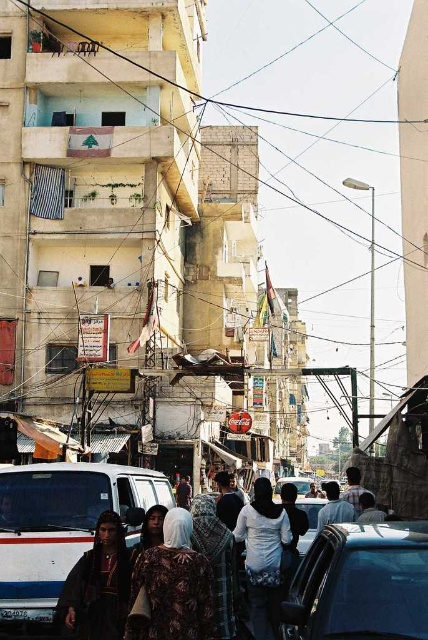
Question: Considering the real-world distances, which object is closest to the metallic wire at upper center?

Choices:
 (A) light brown fabric headscarf at center
 (B) white matte van at center
 (C) dark brown leather jacket at center

Answer: (C)

Question: Which is farther from the floral fabric dress at center?

Choices:
 (A) white matte van at center
 (B) shiny black car at center
 (C) dark brown fabric at center

Answer: (C)

Question: Is dark brown fabric at center to the left of dark brown leather jacket at center from the viewer's perspective?

Choices:
 (A) yes
 (B) no

Answer: (B)

Question: Does shiny black car at center have a smaller size compared to dark brown leather jacket at center?

Choices:
 (A) no
 (B) yes

Answer: (A)

Question: Which point is closer to the camera?

Choices:
 (A) shiny black car at center
 (B) light brown fabric headscarf at center

Answer: (A)

Question: Does white matte van at center have a larger size compared to shiny black car at center?

Choices:
 (A) no
 (B) yes

Answer: (B)